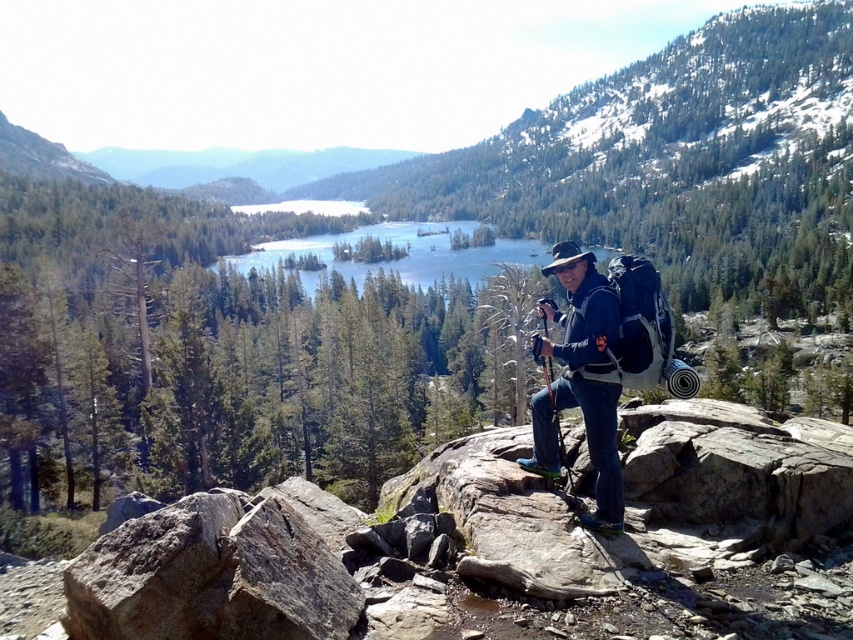
Question: Among these points, which one is farthest from the camera?

Choices:
 (A) (550, 392)
 (B) (459, 256)
 (C) (451, 605)

Answer: (B)

Question: Can you confirm if clear blue water at center is bigger than wooden cane at center?

Choices:
 (A) no
 (B) yes

Answer: (B)

Question: Is matte blue jacket at center wider than wooden cane at center?

Choices:
 (A) no
 (B) yes

Answer: (B)

Question: Among these points, which one is nearest to the camera?

Choices:
 (A) (252, 266)
 (B) (543, 364)
 (C) (665, 481)
 (D) (585, 352)

Answer: (D)

Question: Is gray rock at center to the left of wooden cane at center from the viewer's perspective?

Choices:
 (A) no
 (B) yes

Answer: (B)

Question: Estimate the real-world distances between objects in this image. Which object is closer to the matte blue jacket at center?

Choices:
 (A) clear blue water at center
 (B) gray rock at center

Answer: (B)